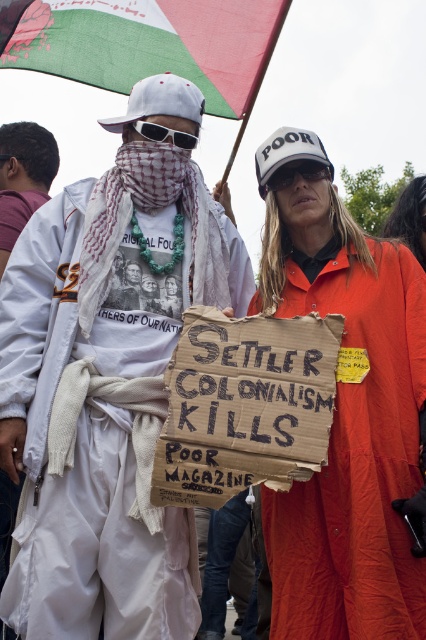
Question: Is white fabric scarf at left thinner than sunglassestransparent at upper center?

Choices:
 (A) no
 (B) yes

Answer: (A)

Question: Which of these objects is positioned closest to the green and white fabric flag at upper left?

Choices:
 (A) matte black photograph at center
 (B) black plastic sunglasses at center
 (C) white fabric scarf at left
 (D) orange cotton robe at center

Answer: (C)

Question: Estimate the real-world distances between objects in this image. Which object is farther from the matte black photograph at center?

Choices:
 (A) green and white fabric flag at upper left
 (B) white fabric scarf at left

Answer: (A)

Question: Where is green and white fabric flag at upper left located in relation to sunglassestransparent at upper center in the image?

Choices:
 (A) below
 (B) above

Answer: (B)

Question: Which object is the farthest from the sunglassestransparent at upper center?

Choices:
 (A) white fabric scarf at left
 (B) matte black photograph at center
 (C) orange cotton robe at center

Answer: (A)

Question: Can you confirm if sunglassestransparent at upper center is positioned to the left of black plastic sunglasses at center?

Choices:
 (A) yes
 (B) no

Answer: (B)